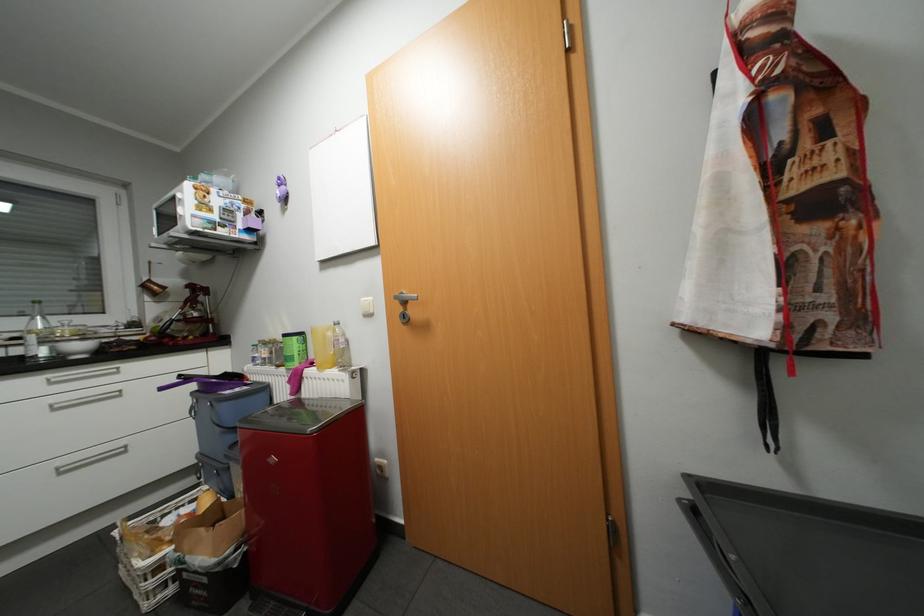
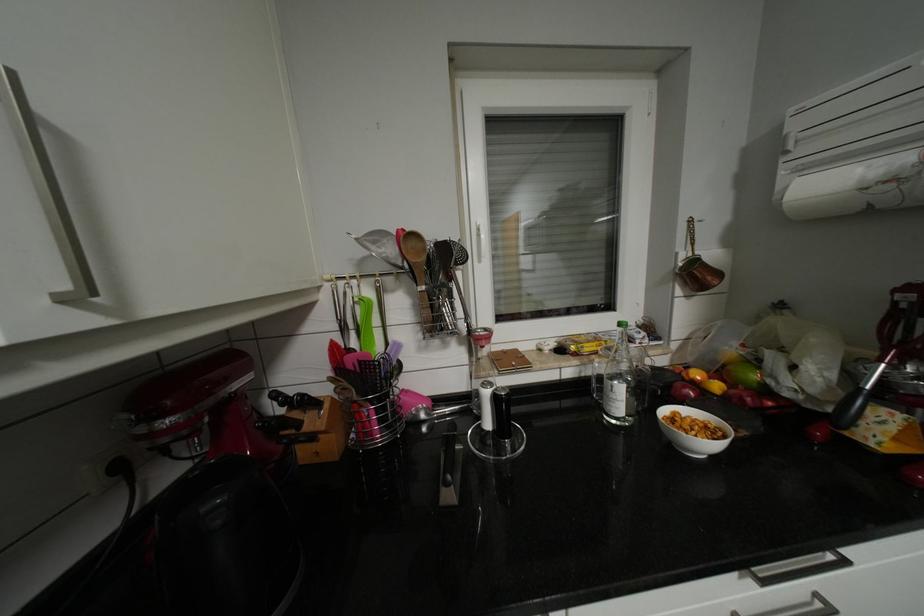
The point at (x=91, y=346) is marked in the first image. Where is the corresponding point in the second image?

(703, 430)